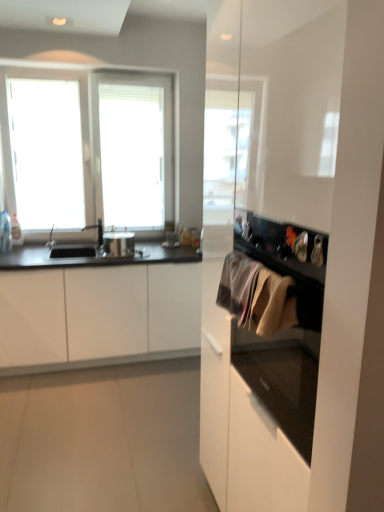
Question: From a real-world perspective, relative to shiny metallic pot at center, is textured beige towel at center right vertically above or below?

Choices:
 (A) below
 (B) above

Answer: (B)

Question: Is textured beige towel at center right taller or shorter than shiny metallic pot at center?

Choices:
 (A) tall
 (B) short

Answer: (A)

Question: Which object is positioned closest to the white matte cabinet at left?

Choices:
 (A) white glossy cabinet at right
 (B) textured beige towel at center right
 (C) silver metallic faucet at left
 (D) shiny metallic pot at center

Answer: (D)

Question: Estimate the real-world distances between objects in this image. Which object is closer to the textured beige towel at center right?

Choices:
 (A) shiny metallic pot at center
 (B) white matte cabinet at left
 (C) white glossy cabinet at right
 (D) silver metallic faucet at left

Answer: (C)